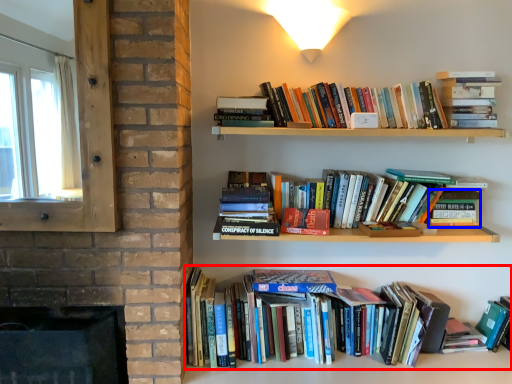
Question: Which of the following is the closest to the observer, book (highlighted by a red box) or paperback book (highlighted by a blue box)?

Choices:
 (A) book
 (B) paperback book

Answer: (A)